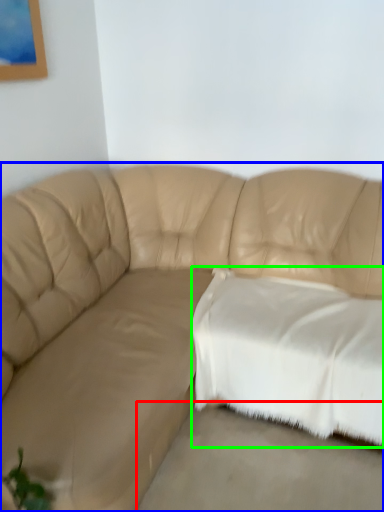
Question: Considering the real-world distances, which object is farthest from concrete (highlighted by a red box)? studio couch (highlighted by a blue box) or pillow (highlighted by a green box)?

Choices:
 (A) studio couch
 (B) pillow

Answer: (A)